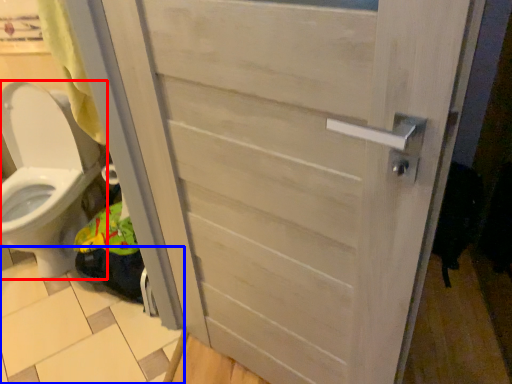
Question: Which point is closer to the camera, toilet (highlighted by a red box) or tile (highlighted by a blue box)?

Choices:
 (A) toilet
 (B) tile

Answer: (A)